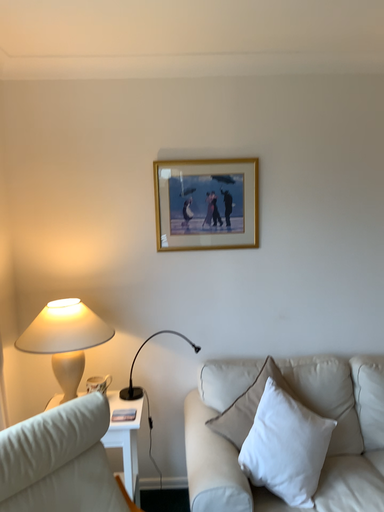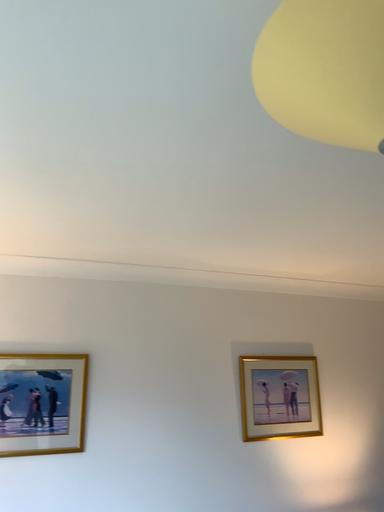
Question: How did the camera likely rotate when shooting the video?

Choices:
 (A) rotated upward
 (B) rotated downward

Answer: (A)